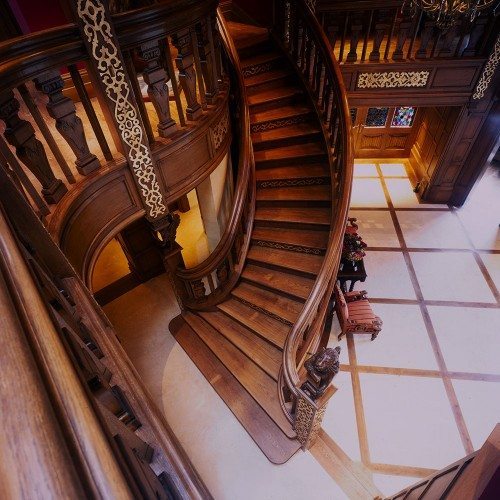
Locate an element on the screen. The image size is (500, 500). mosaic is located at coordinates (406, 118).